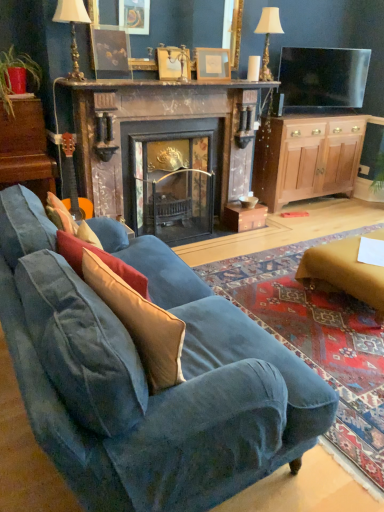
What do you see at coordinates (173, 63) in the screenshot? This screenshot has width=384, height=512. I see `matte gold picture frame at upper center, which is the second picture frame in right-to-left order` at bounding box center [173, 63].

Describe the element at coordinates (268, 37) in the screenshot. Image resolution: width=384 pixels, height=512 pixels. I see `white fabric lampshade at upper center, placed as the first lamp when sorted from right to left` at that location.

Image resolution: width=384 pixels, height=512 pixels. What do you see at coordinates (110, 52) in the screenshot?
I see `matte black picture frame at upper center, marked as the first picture frame in a left-to-right arrangement` at bounding box center [110, 52].

The image size is (384, 512). What do you see at coordinates (307, 157) in the screenshot?
I see `wooden cabinet at right` at bounding box center [307, 157].

Find the location of a particular element. matte gold picture frame at upper center, the second picture frame when ordered from left to right is located at coordinates (173, 63).

Is matte wooden picture frame at upper center, placed as the third picture frame when sorted from left to right, positioned far away from matte gold picture frame at upper center, the second picture frame when ordered from left to right?

They are positioned close to each other.

From the image's perspective, is matte wooden picture frame at upper center, placed as the third picture frame when sorted from left to right, under matte gold picture frame at upper center, the second picture frame when ordered from left to right?

No, from the image's perspective, matte wooden picture frame at upper center, placed as the third picture frame when sorted from left to right, is not below matte gold picture frame at upper center, the second picture frame when ordered from left to right.

At what (x,y) coordinates should I click in order to perform the action: click on picture frame that is under the matte wooden picture frame at upper center, arranged as the first picture frame when viewed from the right (from a real-world perspective). Please return your answer as a coordinate pair (x, y). This screenshot has width=384, height=512. Looking at the image, I should click on (173, 63).

Which object is positioned more to the left, velvet beige throw pillow at lower left or matte gold ottoman at lower right?

velvet beige throw pillow at lower left is more to the left.

From the image's perspective, is velvet beige throw pillow at lower left above or below matte gold ottoman at lower right?

From the image's perspective, velvet beige throw pillow at lower left appears below matte gold ottoman at lower right.

Is velvet beige throw pillow at lower left in contact with matte gold ottoman at lower right?

They are not placed beside each other.

You are a GUI agent. You are given a task and a screenshot of the screen. Output one action in this format:
    pyautogui.click(x=<x>, y=<y>)
    Task: Click on the flat to the right of velvet beige throw pillow at lower left
    
    Given the screenshot: What is the action you would take?
    pyautogui.click(x=343, y=273)

Is point (97, 173) positioned in front of point (21, 325)?

That is False.

Does marble fireplace at center lie in front of velvet blue couch at lower left?

No, it is behind velvet blue couch at lower left.

In terms of height, does marble fireplace at center look taller or shorter compared to velvet blue couch at lower left?

Clearly, marble fireplace at center is taller compared to velvet blue couch at lower left.

In order to click on studio couch on the right of the marble fireplace at center in this screenshot , I will do `click(146, 380)`.

Does matte gold picture frame at upper center, which is the second picture frame in right-to-left order, appear on the left side of matte black picture frame at upper center, marked as the first picture frame in a left-to-right arrangement?

No, matte gold picture frame at upper center, which is the second picture frame in right-to-left order, is not to the left of matte black picture frame at upper center, marked as the first picture frame in a left-to-right arrangement.

You are a GUI agent. You are given a task and a screenshot of the screen. Output one action in this format:
    pyautogui.click(x=<x>, y=<y>)
    Task: Click on the 1st picture frame to the right when counting from the matte black picture frame at upper center, marked as the first picture frame in a left-to-right arrangement
    This screenshot has width=384, height=512.
    Given the screenshot: What is the action you would take?
    pyautogui.click(x=173, y=63)

How many degrees apart are the facing directions of matte gold picture frame at upper center, which is the second picture frame in right-to-left order, and matte black picture frame at upper center, which is the third picture frame in right-to-left order?

0.00256 degrees separate the facing orientations of matte gold picture frame at upper center, which is the second picture frame in right-to-left order, and matte black picture frame at upper center, which is the third picture frame in right-to-left order.

Which is behind, matte gold picture frame at upper center, the second picture frame when ordered from left to right, or matte black picture frame at upper center, marked as the first picture frame in a left-to-right arrangement?

Positioned behind is matte gold picture frame at upper center, the second picture frame when ordered from left to right.

Is matte gold ottoman at lower right positioned far away from wooden dresser at left?

Absolutely, matte gold ottoman at lower right is distant from wooden dresser at left.

Is matte gold ottoman at lower right positioned with its back to wooden dresser at left?

No, matte gold ottoman at lower right is not facing away from wooden dresser at left.

Choose the correct answer: Is matte gold ottoman at lower right inside wooden dresser at left or outside it?

matte gold ottoman at lower right is outside wooden dresser at left.

Is matte gold ottoman at lower right in front of or behind wooden dresser at left in the image?

Clearly, matte gold ottoman at lower right is in front of wooden dresser at left.

Would you say dark wood mantel at upper center is to the left or to the right of white fabric lampshade at upper center, arranged as the second lamp when viewed from the front, in the picture?

In the image, dark wood mantel at upper center appears on the left side of white fabric lampshade at upper center, arranged as the second lamp when viewed from the front.

Is dark wood mantel at upper center positioned behind white fabric lampshade at upper center, arranged as the second lamp when viewed from the front?

No, it is not.

Does dark wood mantel at upper center have a greater height compared to white fabric lampshade at upper center, the first lamp from the back?

No, dark wood mantel at upper center is not taller than white fabric lampshade at upper center, the first lamp from the back.

Does velvet blue couch at lower left have a greater height compared to wooden cabinet at right?

Incorrect, the height of velvet blue couch at lower left is not larger of that of wooden cabinet at right.

Who is more distant, velvet blue couch at lower left or wooden cabinet at right?

Positioned behind is wooden cabinet at right.

In the scene shown: From a real-world perspective, between velvet blue couch at lower left and wooden cabinet at right, who is vertically lower?

From a 3D spatial view, velvet blue couch at lower left is below.

From the image's perspective, is velvet blue couch at lower left above wooden cabinet at right?

Incorrect, from the image's perspective, velvet blue couch at lower left is lower than wooden cabinet at right.

You are a GUI agent. You are given a task and a screenshot of the screen. Output one action in this format:
    pyautogui.click(x=<x>, y=<y>)
    Task: Click on the 1st picture frame counting from the left side of the matte wooden picture frame at upper center, arranged as the first picture frame when viewed from the right
    Image resolution: width=384 pixels, height=512 pixels.
    Given the screenshot: What is the action you would take?
    pyautogui.click(x=173, y=63)

This screenshot has width=384, height=512. What are the coordinates of `throw pillow above the matte gold ottoman at lower right (from a real-world perspective)` in the screenshot? It's located at (140, 323).

When comparing their distances from wooden cabinet at right, does velvet beige throw pillow at lower left or gold metallic lamp at upper left, which is the 1th lamp from left to right, seem closer?

gold metallic lamp at upper left, which is the 1th lamp from left to right.

Which object lies further to the anchor point matte gold picture frame at upper center, the second picture frame when ordered from left to right, dark wood mantel at upper center or gold metallic lamp at upper left, positioned as the 2th lamp in right-to-left order?

gold metallic lamp at upper left, positioned as the 2th lamp in right-to-left order, is further to matte gold picture frame at upper center, the second picture frame when ordered from left to right.

Based on their spatial positions, is brown suede pillow at center or matte gold picture frame at upper center, which is the second picture frame in right-to-left order, further from wooden cabinet at right?

brown suede pillow at center lies further to wooden cabinet at right than the other object.

Considering their positions, is brown suede pillow at center positioned further to matte gold ottoman at lower right than flat-screen tv at upper right?

The object further to matte gold ottoman at lower right is flat-screen tv at upper right.

When comparing their distances from velvet blue couch at lower left, does matte gold ottoman at lower right or matte gold picture frame at upper center, the second picture frame when ordered from left to right, seem further?

matte gold picture frame at upper center, the second picture frame when ordered from left to right, is positioned further to the anchor velvet blue couch at lower left.

Based on their spatial positions, is flat-screen tv at upper right or wooden cabinet at right closer to matte gold picture frame at upper center, the second picture frame when ordered from left to right?

flat-screen tv at upper right lies closer to matte gold picture frame at upper center, the second picture frame when ordered from left to right, than the other object.

Which object lies further to the anchor point brown suede pillow at center, gold metallic lamp at upper left, the first lamp positioned from the front, or matte wooden picture frame at upper center, arranged as the first picture frame when viewed from the right?

matte wooden picture frame at upper center, arranged as the first picture frame when viewed from the right, lies further to brown suede pillow at center than the other object.

In the scene shown: Estimate the real-world distances between objects in this image. Which object is closer to velvet beige throw pillow at lower left, dark wood mantel at upper center or matte gold ottoman at lower right?

matte gold ottoman at lower right is positioned closer to the anchor velvet beige throw pillow at lower left.

Locate an element on the screen. The height and width of the screenshot is (512, 384). dresser between gold metallic lamp at upper left, which is the 1th lamp from left to right, and brown suede pillow at center, in the vertical direction is located at coordinates (26, 148).

This screenshot has width=384, height=512. I want to click on pillow that lies between matte black picture frame at upper center, which is the third picture frame in right-to-left order, and velvet beige throw pillow at lower left from top to bottom, so click(x=101, y=260).

Locate an element on the screen. This screenshot has height=512, width=384. fireplace between velvet beige throw pillow at lower left and matte wooden picture frame at upper center, placed as the third picture frame when sorted from left to right, from front to back is located at coordinates (165, 154).

The image size is (384, 512). In order to click on mantle between matte gold picture frame at upper center, the second picture frame when ordered from left to right, and brown suede pillow at center, in the vertical direction in this screenshot , I will do `click(161, 84)`.